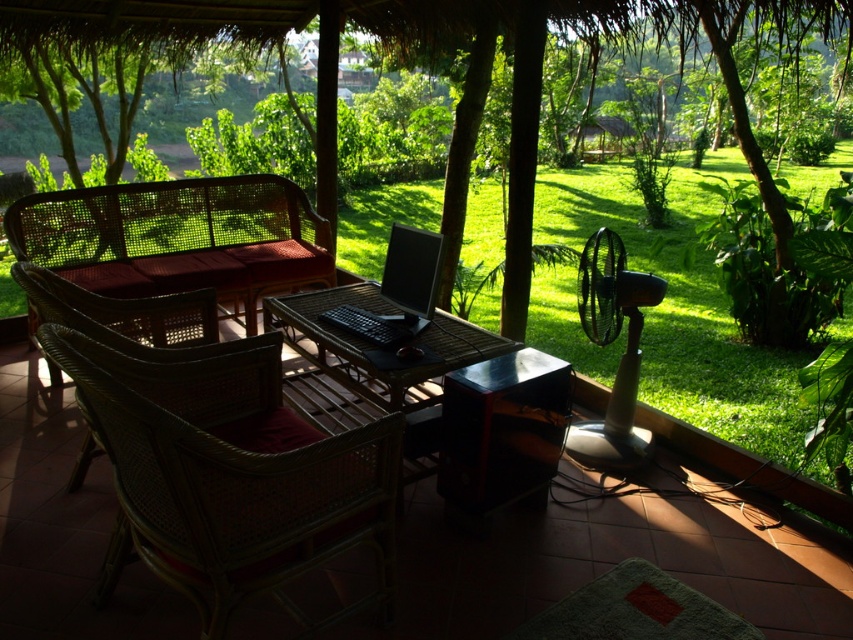
You are a guest at the resort and want to choose a chair to sit in. The woven rattan chair at center and the woven rattan chair at left are both available. Which one is taller?

The woven rattan chair at center is much taller than the woven rattan chair at left.

You are a photographer holding a camera and want to take a photo of the green leafy tree at center from a distance where the tree fills the frame without being too close. Given that the ideal distance for such a shot is between 2.5 to 3 meters, is your current position suitable?

The green leafy tree at center and camera are 2.75 meters apart, which falls within the ideal distance range of 2.5 to 3 meters. Therefore, your current position is suitable for taking the photo.

You are standing at the entrance of the patio and want to sit down at the woven rattan chair at center. Based on the coordinates provided, in which direction should you walk to reach the chair?

The woven rattan chair at center is located at coordinates point (233,497), so you should walk forward and to the right to reach it.